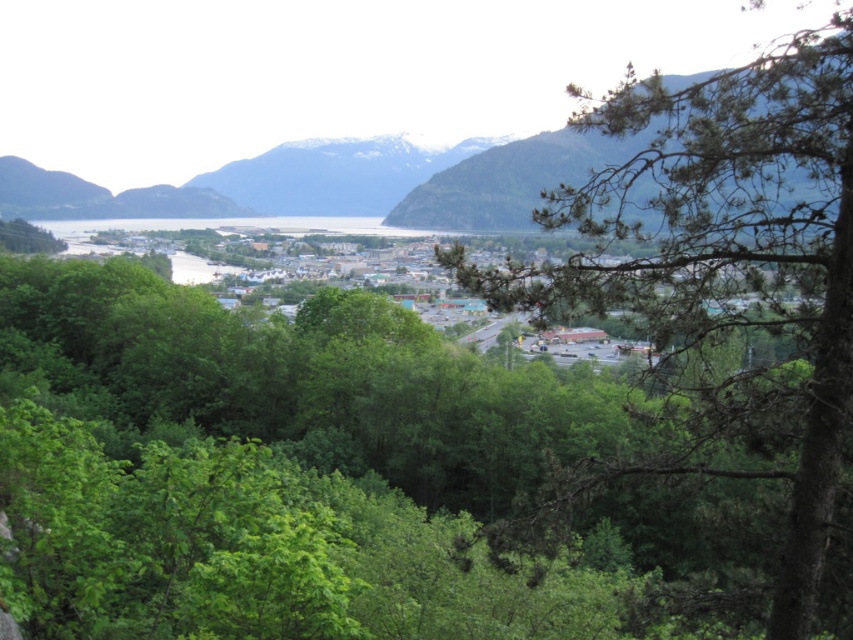
Who is higher up, green leafy tree at center or green textured mountain at upper center?

green textured mountain at upper center is above.

Who is more forward, (792, 580) or (665, 76)?

Point (792, 580) is in front.

You are a GUI agent. You are given a task and a screenshot of the screen. Output one action in this format:
    pyautogui.click(x=<x>, y=<y>)
    Task: Click on the green leafy tree at center
    
    Given the screenshot: What is the action you would take?
    pyautogui.click(x=728, y=269)

Where is `green leafy tree at center`? This screenshot has width=853, height=640. green leafy tree at center is located at coordinates (728, 269).

Is green leafy tree at center thinner than snowy rock mountain at center?

Yes.

Which of these two, green leafy tree at center or snowy rock mountain at center, stands shorter?

green leafy tree at center

This screenshot has height=640, width=853. What are the coordinates of `green leafy tree at center` in the screenshot? It's located at (728, 269).

Is green textured mountain at upper center shorter than snowy rock mountain at center?

In fact, green textured mountain at upper center may be taller than snowy rock mountain at center.

Can you confirm if green textured mountain at upper center is bigger than snowy rock mountain at center?

Indeed, green textured mountain at upper center has a larger size compared to snowy rock mountain at center.

The width and height of the screenshot is (853, 640). What do you see at coordinates (511, 179) in the screenshot? I see `green textured mountain at upper center` at bounding box center [511, 179].

Locate an element on the screen. This screenshot has width=853, height=640. green textured mountain at upper center is located at coordinates (511, 179).